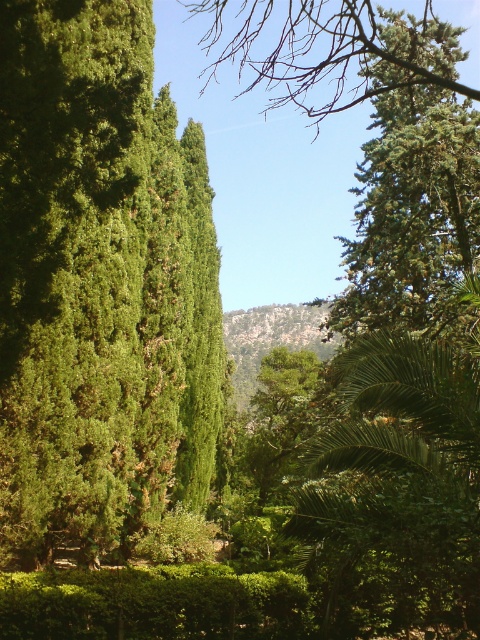
Can you confirm if green leafy tree at left is thinner than green leafy hedge at center?

Yes, green leafy tree at left is thinner than green leafy hedge at center.

Find the location of a particular element. green leafy tree at left is located at coordinates (99, 282).

Is point (141, 60) more distant than point (24, 604)?

Yes.

Where is `green leafy tree at left`? green leafy tree at left is located at coordinates [x=99, y=282].